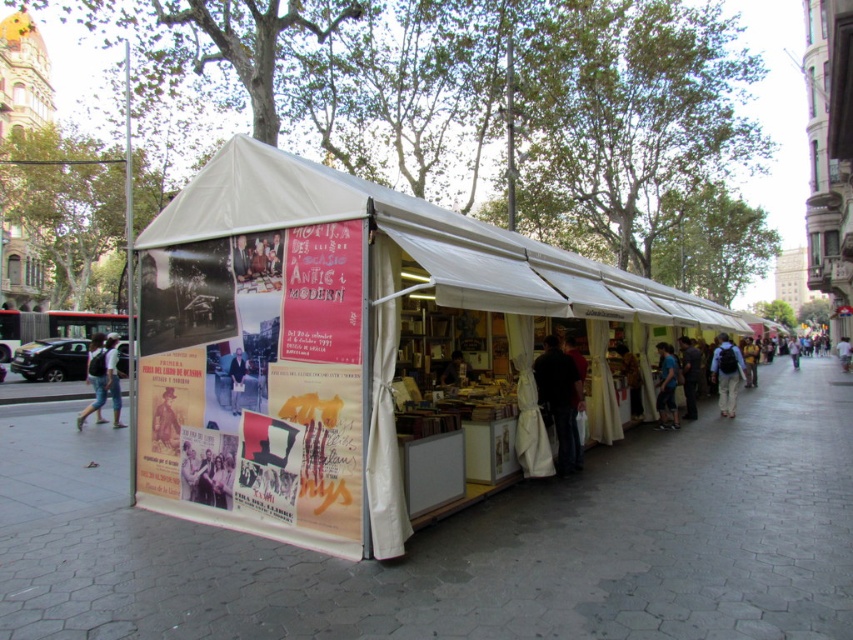
Is white fabric tent at center in front of matte yellow shirt at center?

That is True.

Does white fabric tent at center appear under matte yellow shirt at center?

No, white fabric tent at center is not below matte yellow shirt at center.

At what (x,y) coordinates should I click in order to perform the action: click on white fabric tent at center. Please return your answer as a coordinate pair (x, y). The width and height of the screenshot is (853, 640). Looking at the image, I should click on (323, 339).

The height and width of the screenshot is (640, 853). What do you see at coordinates (560, 401) in the screenshot?
I see `dark clothing at center` at bounding box center [560, 401].

Measure the distance from dark clothing at center to matte black book at center.

2.44 meters

Is point (581, 465) positioned after point (466, 364)?

No.

Find the location of a particular element. This screenshot has width=853, height=640. dark clothing at center is located at coordinates (560, 401).

Does printed paper poster at left have a greater height compared to dark blue jeans at lower center?

Correct, printed paper poster at left is much taller as dark blue jeans at lower center.

Is point (326, 292) closer to viewer compared to point (683, 397)?

Yes, it is.

Find the location of a particular element. Image resolution: width=853 pixels, height=640 pixels. printed paper poster at left is located at coordinates (254, 376).